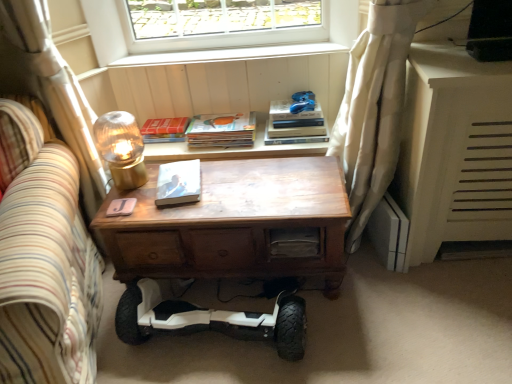
Where is `wooden desk at center`? The image size is (512, 384). wooden desk at center is located at coordinates (233, 223).

The width and height of the screenshot is (512, 384). Describe the element at coordinates (121, 149) in the screenshot. I see `translucent glass lampshade at upper left` at that location.

The image size is (512, 384). What do you see at coordinates (211, 318) in the screenshot?
I see `white matte segway at lower center` at bounding box center [211, 318].

The width and height of the screenshot is (512, 384). What do you see at coordinates (55, 90) in the screenshot?
I see `white sheer curtain at left, which is counted as the 1th curtain, starting from the left` at bounding box center [55, 90].

What do you see at coordinates (222, 130) in the screenshot?
I see `matte paper book at center, arranged as the 2th paperback book when ordered from the bottom` at bounding box center [222, 130].

Find the location of `matte paper book at center, positioned as the second paperback book in front-to-back order`. matte paper book at center, positioned as the second paperback book in front-to-back order is located at coordinates (222, 130).

This screenshot has width=512, height=384. I want to click on white wood window sill at upper center, so click(x=228, y=55).

Could you measure the distance between white fabric curtain at right, which is counted as the second curtain, starting from the left, and white matte segway at lower center?

white fabric curtain at right, which is counted as the second curtain, starting from the left, and white matte segway at lower center are 72.09 centimeters apart from each other.

Considering the sizes of objects white fabric curtain at right, positioned as the first curtain in right-to-left order, and white matte segway at lower center in the image provided, who is taller, white fabric curtain at right, positioned as the first curtain in right-to-left order, or white matte segway at lower center?

white fabric curtain at right, positioned as the first curtain in right-to-left order.

From a real-world perspective, which curtain is the 2nd one above the white matte segway at lower center? Please provide its 2D coordinates.

[(374, 108)]

Considering the positions of objects white fabric curtain at right, positioned as the first curtain in right-to-left order, and white matte segway at lower center in the image provided, who is more to the left, white fabric curtain at right, positioned as the first curtain in right-to-left order, or white matte segway at lower center?

white matte segway at lower center is more to the left.

Is matte white book at center, placed as the first paperback book when sorted from front to back, shorter than striped fabric couch at left?

Indeed, matte white book at center, placed as the first paperback book when sorted from front to back, has a lesser height compared to striped fabric couch at left.

Would you consider matte white book at center, placed as the first paperback book when sorted from front to back, to be distant from striped fabric couch at left?

matte white book at center, placed as the first paperback book when sorted from front to back, is actually quite close to striped fabric couch at left.

Is point (170, 175) behind point (59, 232)?

Yes.

From a real-world perspective, which is physically above, matte white book at center, placed as the first paperback book when sorted from bottom to top, or striped fabric couch at left?

matte white book at center, placed as the first paperback book when sorted from bottom to top, from a real-world perspective.

Considering the relative positions of matte white book at center, placed as the first paperback book when sorted from front to back, and matte paper book at center, positioned as the second paperback book in front-to-back order, in the image provided, is matte white book at center, placed as the first paperback book when sorted from front to back, behind matte paper book at center, positioned as the second paperback book in front-to-back order,?

No, matte white book at center, placed as the first paperback book when sorted from front to back, is closer to the camera.

Is matte white book at center, placed as the first paperback book when sorted from front to back, not within matte paper book at center, arranged as the 2th paperback book when ordered from the bottom?

Yes, matte white book at center, placed as the first paperback book when sorted from front to back, is located beyond the bounds of matte paper book at center, arranged as the 2th paperback book when ordered from the bottom.

Between point (157, 205) and point (221, 116), which one is positioned behind?

The point (221, 116) is farther.

Can you confirm if matte white book at center, placed as the first paperback book when sorted from bottom to top, is wider than matte paper book at center, positioned as the second paperback book in front-to-back order?

Indeed, matte white book at center, placed as the first paperback book when sorted from bottom to top, has a greater width compared to matte paper book at center, positioned as the second paperback book in front-to-back order.

From the image's perspective, is matte white book at center, the 3th paperback book in the top-to-bottom sequence, above or below wooden desk at center?

Clearly, from the image's perspective, matte white book at center, the 3th paperback book in the top-to-bottom sequence, is above wooden desk at center.

Between matte white book at center, the 3th paperback book in the top-to-bottom sequence, and wooden desk at center, which one has smaller size?

matte white book at center, the 3th paperback book in the top-to-bottom sequence.

Does matte white book at center, placed as the first paperback book when sorted from front to back, have a lesser width compared to wooden desk at center?

Yes, matte white book at center, placed as the first paperback book when sorted from front to back, is thinner than wooden desk at center.

Considering the relative positions of matte white book at center, placed as the first paperback book when sorted from bottom to top, and wooden desk at center in the image provided, is matte white book at center, placed as the first paperback book when sorted from bottom to top, to the left of wooden desk at center from the viewer's perspective?

Correct, you'll find matte white book at center, placed as the first paperback book when sorted from bottom to top, to the left of wooden desk at center.

Is hardcover book at upper center, which ranks as the 3th paperback book in bottom-to-top order, with wooden desk at center?

No, hardcover book at upper center, which ranks as the 3th paperback book in bottom-to-top order, is not next to wooden desk at center.

Looking at this image, from the image's perspective, is hardcover book at upper center, which ranks as the 3th paperback book in bottom-to-top order, over wooden desk at center?

Yes.

Is hardcover book at upper center, which ranks as the 3th paperback book in front-to-back order, facing away from wooden desk at center?

No, wooden desk at center is not at the back of hardcover book at upper center, which ranks as the 3th paperback book in front-to-back order.

From a real-world perspective, is hardcover book at upper center, which ranks as the 3th paperback book in front-to-back order, physically located above or below wooden desk at center?

Clearly, from a real-world perspective, hardcover book at upper center, which ranks as the 3th paperback book in front-to-back order, is above wooden desk at center.

Which is less distant, (230, 140) or (349, 81)?

Point (230, 140) appears to be farther away from the viewer than point (349, 81).

Is matte paper book at center, arranged as the 2th paperback book when ordered from the bottom, inside or outside of white fabric curtain at right, positioned as the first curtain in right-to-left order?

matte paper book at center, arranged as the 2th paperback book when ordered from the bottom, is outside white fabric curtain at right, positioned as the first curtain in right-to-left order.

Which of these two, matte paper book at center, the second paperback book viewed from the back, or white fabric curtain at right, positioned as the first curtain in right-to-left order, is wider?

Wider between the two is white fabric curtain at right, positioned as the first curtain in right-to-left order.

The image size is (512, 384). What are the coordinates of `the 2nd paperback book behind the white fabric curtain at right, positioned as the first curtain in right-to-left order` in the screenshot? It's located at (222, 130).

Where is `couch lying in front of the white matte segway at lower center`? This screenshot has width=512, height=384. couch lying in front of the white matte segway at lower center is located at coordinates (44, 259).

Is point (262, 323) closer or farther from the camera than point (57, 321)?

Point (262, 323).

Based on their sizes in the image, would you say white matte segway at lower center is bigger or smaller than striped fabric couch at left?

Clearly, white matte segway at lower center is smaller in size than striped fabric couch at left.

From the image's perspective, count 2nd curtains upward from the white matte segway at lower center and point to it. Please provide its 2D coordinates.

[(374, 108)]

At what (x,y) coordinates should I click in order to perform the action: click on couch on the left of matte white book at center, placed as the first paperback book when sorted from bottom to top. Please return your answer as a coordinate pair (x, y). Looking at the image, I should click on (44, 259).

From the image, which object appears to be nearer to hardcover book at upper center, the first paperback book viewed from the back, matte paper book at center, positioned as the second paperback book in front-to-back order, or translucent glass lampshade at upper left?

The object closer to hardcover book at upper center, the first paperback book viewed from the back, is matte paper book at center, positioned as the second paperback book in front-to-back order.

Which object lies further to the anchor point blue fabric toy at upper center, white matte segway at lower center or matte white book at center, placed as the first paperback book when sorted from front to back?

white matte segway at lower center lies further to blue fabric toy at upper center than the other object.

Estimate the real-world distances between objects in this image. Which object is further from white wood window sill at upper center, hardcover book at upper center, placed as the 1th paperback book when sorted from top to bottom, or matte paper book at center, acting as the second paperback book starting from the top?

hardcover book at upper center, placed as the 1th paperback book when sorted from top to bottom, is further to white wood window sill at upper center.

From the image, which object appears to be farther from wooden desk at center, matte paper book at center, the second paperback book viewed from the back, or white wood window sill at upper center?

Based on the image, white wood window sill at upper center appears to be further to wooden desk at center.

Based on their spatial positions, is hardcover book at upper center, placed as the 1th paperback book when sorted from top to bottom, or white fabric curtain at right, which is counted as the second curtain, starting from the left, closer to wooden desk at center?

white fabric curtain at right, which is counted as the second curtain, starting from the left, lies closer to wooden desk at center than the other object.

Looking at the image, which one is located closer to white matte segway at lower center, hardcover book at upper center, placed as the 1th paperback book when sorted from top to bottom, or striped fabric couch at left?

Among the two, striped fabric couch at left is located nearer to white matte segway at lower center.

From the image, which object appears to be farther from white wood window sill at upper center, translucent glass lampshade at upper left or white matte segway at lower center?

white matte segway at lower center lies further to white wood window sill at upper center than the other object.

Based on their spatial positions, is white wood window sill at upper center or hardcover books at upper right further from blue fabric toy at upper center?

white wood window sill at upper center lies further to blue fabric toy at upper center than the other object.

You are a GUI agent. You are given a task and a screenshot of the screen. Output one action in this format:
    pyautogui.click(x=<x>, y=<y>)
    Task: Click on the book located between translucent glass lampshade at upper left and blue fabric toy at upper center in the left-right direction
    
    Given the screenshot: What is the action you would take?
    pyautogui.click(x=294, y=125)

Locate an element on the screen. table lamp located between striped fabric couch at left and wooden drawer at center in the left-right direction is located at coordinates (121, 149).

This screenshot has width=512, height=384. Find the location of `window sill between translucent glass lampshade at upper left and blue fabric toy at upper center in the horizontal direction`. window sill between translucent glass lampshade at upper left and blue fabric toy at upper center in the horizontal direction is located at coordinates (228, 55).

At what (x,y) coordinates should I click in order to perform the action: click on drawer between white sheer curtain at left, which appears as the second curtain when viewed from the right, and hardcover books at upper right, in the horizontal direction. Please return your answer as a coordinate pair (x, y). Looking at the image, I should click on (294, 242).